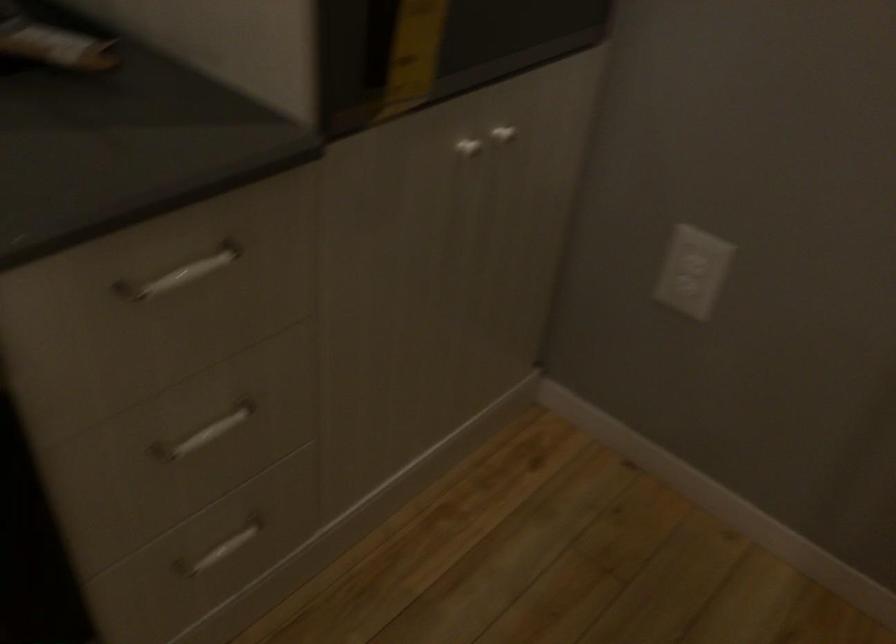
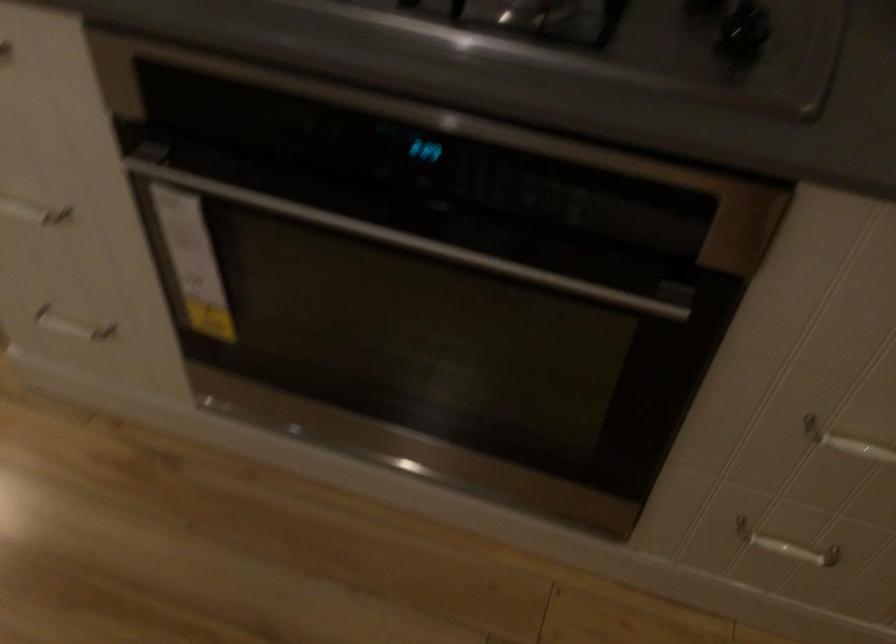
First-person continuous shooting, in which direction is the camera rotating?

The rotation direction of the camera is left-down.